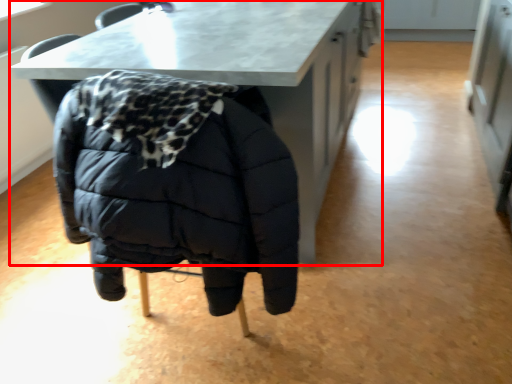
Question: From the image's perspective, where is table (annotated by the red box) located relative to jacket?

Choices:
 (A) below
 (B) above

Answer: (B)